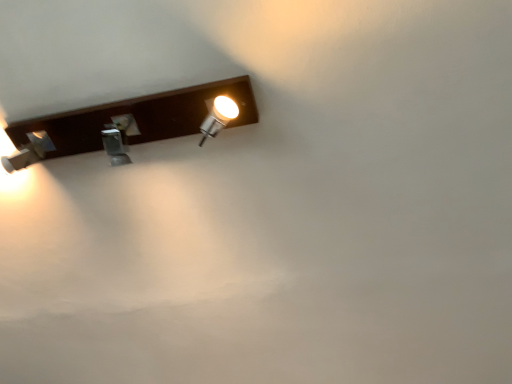
This screenshot has width=512, height=384. Identify the location of matte brown light fixture at upper left. (x=138, y=118).

Image resolution: width=512 pixels, height=384 pixels. What do you see at coordinates (138, 118) in the screenshot?
I see `matte brown light fixture at upper left` at bounding box center [138, 118].

The image size is (512, 384). In order to click on matte brown light fixture at upper left in this screenshot , I will do `click(138, 118)`.